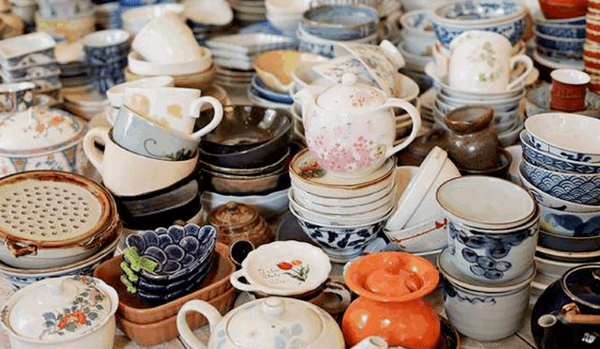
Where is `teacups`? teacups is located at coordinates (464, 61), (180, 42), (172, 105), (155, 129), (128, 166), (113, 96), (110, 45).